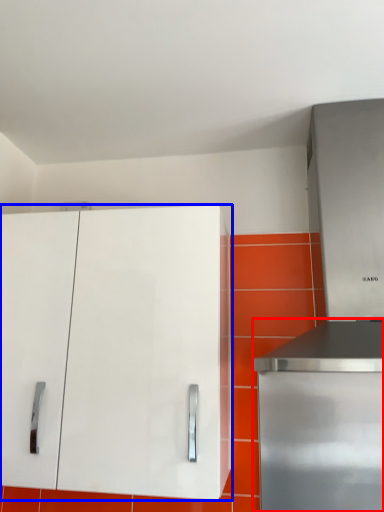
Question: Among these objects, which one is farthest to the camera, home appliance (highlighted by a red box) or cabinetry (highlighted by a blue box)?

Choices:
 (A) home appliance
 (B) cabinetry

Answer: (A)